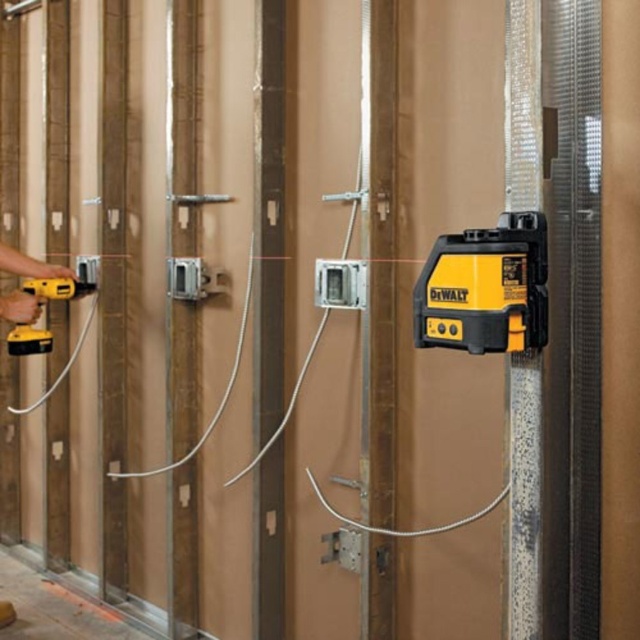
Question: Considering the relative positions of yellow/black plastic laser level at center and yellow/black power drill at left in the image provided, where is yellow/black plastic laser level at center located with respect to yellow/black power drill at left?

Choices:
 (A) right
 (B) left

Answer: (A)

Question: Does yellow/black plastic laser level at center appear over yellow/black power drill at left?

Choices:
 (A) no
 (B) yes

Answer: (B)

Question: Which point appears farthest from the camera in this image?

Choices:
 (A) (461, 256)
 (B) (8, 348)

Answer: (B)

Question: Does yellow/black plastic laser level at center have a greater width compared to yellow/black power drill at left?

Choices:
 (A) yes
 (B) no

Answer: (B)